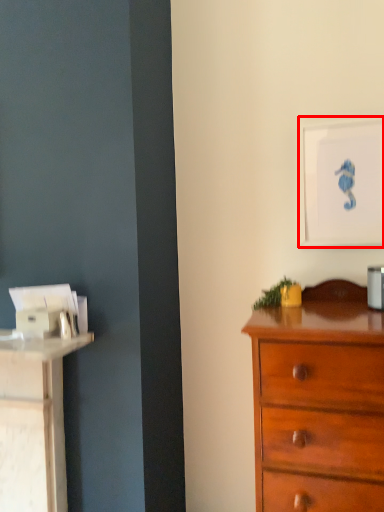
Question: From the image's perspective, what is the correct spatial positioning of picture frame (annotated by the red box) in reference to chest of drawers?

Choices:
 (A) above
 (B) below

Answer: (A)